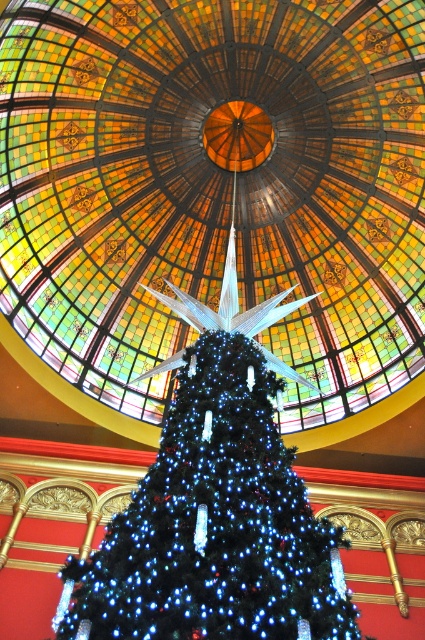
You are standing in the room with the Christmas tree and looking up at the stained glass dome ceiling. There is a point marked at coordinates (214, 186). Can you tell me what object this point is located on?

The point at coordinates (214, 186) is located on the stained glass dome at center.

You are standing in front of the Christmas tree and want to take a photo. You notice two points marked in the scene. The first point is at coordinates point (385, 88) and the second is at point (223, 518). Which point is closer to your camera lens?

Point (223, 518) is closer to the camera lens because the description states that point (385, 88) is further away from the camera than point (223, 518).